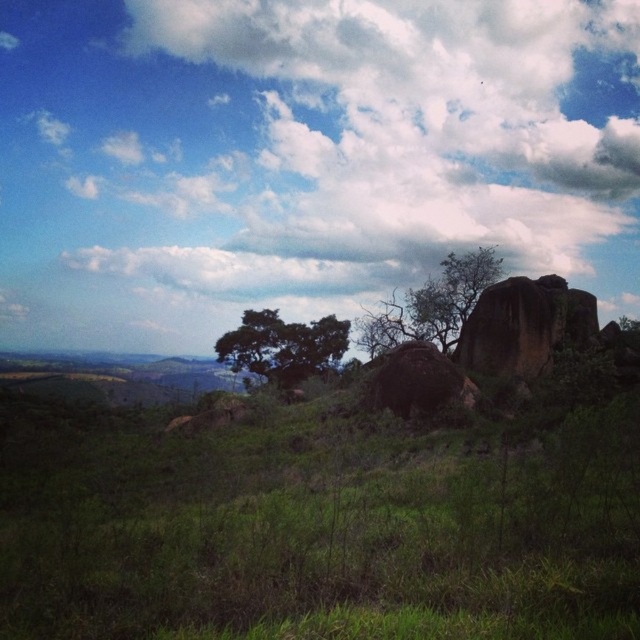
You are standing in the field and looking towards the green leafy tree at upper right and the green leafy tree at center. Which tree is closer to you?

The green leafy tree at center is closer to you because the green leafy tree at upper right is positioned over it, indicating it is farther away.

You are standing in the field and want to take a photo that includes both the white fluffy cloud at upper center and the green leafy tree at upper right. Given that your camera has a maximum zoom range of 100 meters, can you capture both in a single frame without moving?

The white fluffy cloud at upper center is 120.38 meters away from the green leafy tree at upper right. Since the distance exceeds the camera maximum zoom range of 100 meters, you cannot capture both in a single frame without moving.

You are an astronomer analyzing the image of the sky. You need to locate the white fluffy cloud at upper center. What are its coordinates in the image?

The white fluffy cloud at upper center is located at coordinates (304, 157).